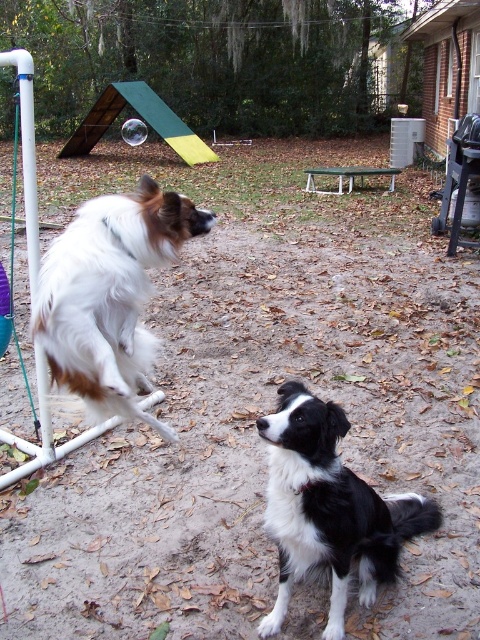
You are a photographer standing in the backyard. You want to take a photo of both the white and brown fur dog at left and the black and white fur at center. Which dog should you focus on first to ensure it is in sharp focus?

The white and brown fur dog at left is closer to you than the black and white fur at center. To ensure sharp focus, you should focus on the white and brown fur dog at left first.

You are a dog trainer observing two dogs in a training session. The white and brown fur dog at left is practicing jumps while the black and white fur at center is resting. If you need to place a treat between them so both can reach it easily, where should you put it?

The treat should be placed exactly halfway between the white and brown fur dog at left and the black and white fur at center since they are 33.15 inches apart, ensuring both can reach it without difficulty.